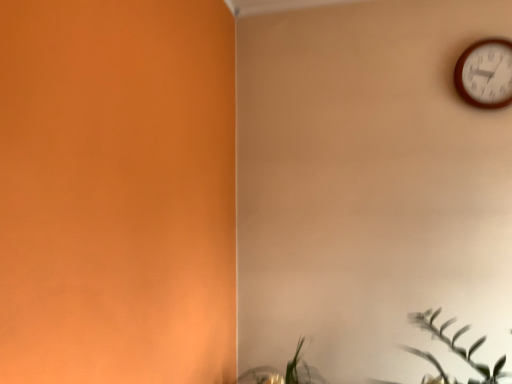
What is the approximate height of wooden wall clock at upper right?

12.44 inches.

Find the location of a particular element. The height and width of the screenshot is (384, 512). wooden wall clock at upper right is located at coordinates (485, 74).

The image size is (512, 384). Describe the element at coordinates (485, 74) in the screenshot. I see `wooden wall clock at upper right` at that location.

Find the location of `wooden wall clock at upper right`. wooden wall clock at upper right is located at coordinates (485, 74).